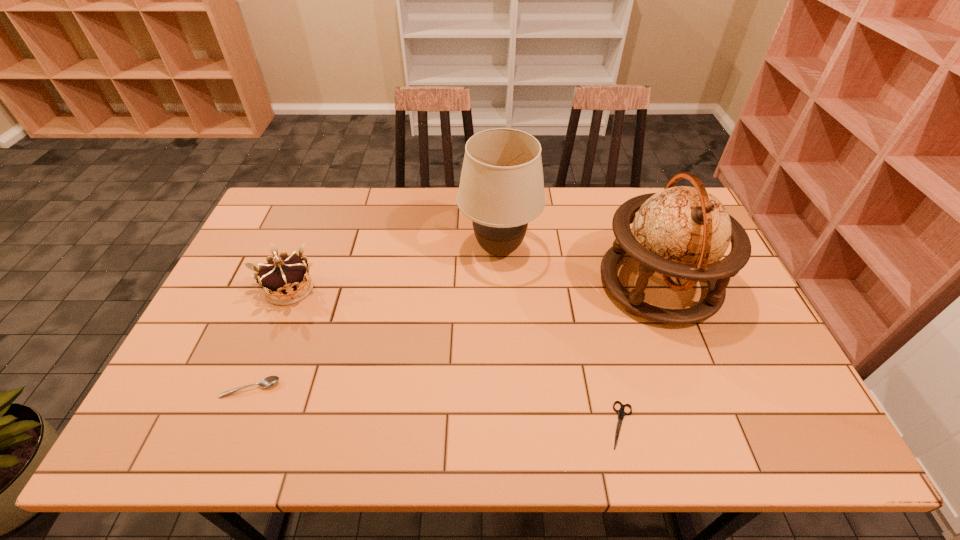
In the image, there is a desktop. Where is `free space at the right edge`? free space at the right edge is located at coordinates (752, 336).

At what (x,y) coordinates should I click in order to perform the action: click on vacant point at the near left corner. Please return your answer as a coordinate pair (x, y). Image resolution: width=960 pixels, height=540 pixels. Looking at the image, I should click on (147, 434).

At what (x,y) coordinates should I click in order to perform the action: click on free spot between the crown and the second object from right to left. Please return your answer as a coordinate pair (x, y). Image resolution: width=960 pixels, height=540 pixels. Looking at the image, I should click on (456, 356).

Locate an element on the screen. The width and height of the screenshot is (960, 540). vacant point located between the crown and the second object from right to left is located at coordinates (456, 356).

Locate an element on the screen. This screenshot has height=540, width=960. vacant space that's between the rightmost object and the crown is located at coordinates (474, 286).

At what (x,y) coordinates should I click in order to perform the action: click on vacant space that is in between the shortest object and the fourth farthest object. Please return your answer as a coordinate pair (x, y). This screenshot has width=960, height=540. Looking at the image, I should click on (436, 407).

I want to click on free space between the third object from right to left and the soupspoon, so click(x=374, y=319).

Locate an element on the screen. The height and width of the screenshot is (540, 960). free space between the crown and the second object from right to left is located at coordinates (456, 356).

The height and width of the screenshot is (540, 960). Identify the location of vacant area that lies between the third object from right to left and the crown. (395, 269).

Where is `free space that is in between the fourth farthest object and the third tallest object`? The image size is (960, 540). free space that is in between the fourth farthest object and the third tallest object is located at coordinates (270, 338).